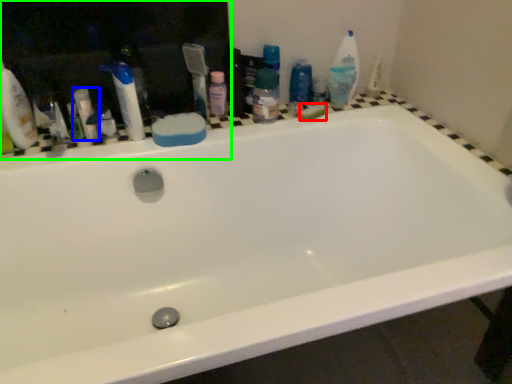
Question: Based on their relative distances, which object is farther from soap (highlighted by a red box)? Choose from toiletry (highlighted by a blue box) and medicine cabinet (highlighted by a green box).

Choices:
 (A) toiletry
 (B) medicine cabinet

Answer: (A)